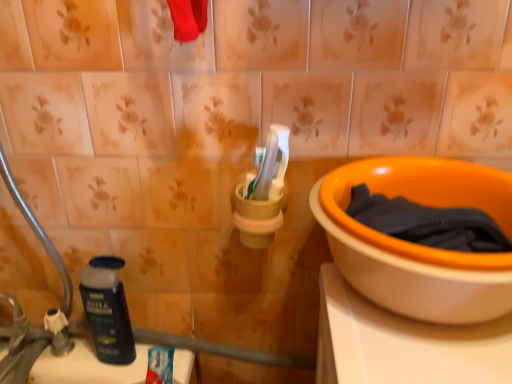
Question: Is the position of silver metallic faucet at lower left less distant than that of dark blue plastic bottle at lower left?

Choices:
 (A) no
 (B) yes

Answer: (B)

Question: Is silver metallic faucet at lower left at the right side of dark blue plastic bottle at lower left?

Choices:
 (A) yes
 (B) no

Answer: (B)

Question: Considering the relative sizes of silver metallic faucet at lower left and dark blue plastic bottle at lower left in the image provided, is silver metallic faucet at lower left smaller than dark blue plastic bottle at lower left?

Choices:
 (A) no
 (B) yes

Answer: (A)

Question: Is silver metallic faucet at lower left facing towards dark blue plastic bottle at lower left?

Choices:
 (A) no
 (B) yes

Answer: (A)

Question: Considering the relative positions of silver metallic faucet at lower left and dark blue plastic bottle at lower left in the image provided, is silver metallic faucet at lower left behind dark blue plastic bottle at lower left?

Choices:
 (A) yes
 (B) no

Answer: (B)

Question: Is dark blue fabric at right to the left or to the right of silver metallic faucet at lower left in the image?

Choices:
 (A) left
 (B) right

Answer: (B)

Question: From the image's perspective, is dark blue fabric at right above or below silver metallic faucet at lower left?

Choices:
 (A) above
 (B) below

Answer: (A)

Question: From a real-world perspective, is dark blue fabric at right above or below silver metallic faucet at lower left?

Choices:
 (A) above
 (B) below

Answer: (A)

Question: In terms of size, does dark blue fabric at right appear bigger or smaller than silver metallic faucet at lower left?

Choices:
 (A) small
 (B) big

Answer: (A)

Question: In terms of width, does orange ceramic bowl at right look wider or thinner when compared to dark blue plastic bottle at lower left?

Choices:
 (A) thin
 (B) wide

Answer: (B)

Question: Based on their positions, is orange ceramic bowl at right located to the left or right of dark blue plastic bottle at lower left?

Choices:
 (A) left
 (B) right

Answer: (B)

Question: Is point (384, 261) closer or farther from the camera than point (116, 261)?

Choices:
 (A) closer
 (B) farther

Answer: (A)

Question: In terms of height, does orange ceramic bowl at right look taller or shorter compared to dark blue plastic bottle at lower left?

Choices:
 (A) short
 (B) tall

Answer: (A)

Question: Is dark blue plastic bottle at lower left taller or shorter than silver metallic faucet at lower left?

Choices:
 (A) short
 (B) tall

Answer: (B)

Question: Based on their sizes in the image, would you say dark blue plastic bottle at lower left is bigger or smaller than silver metallic faucet at lower left?

Choices:
 (A) small
 (B) big

Answer: (A)